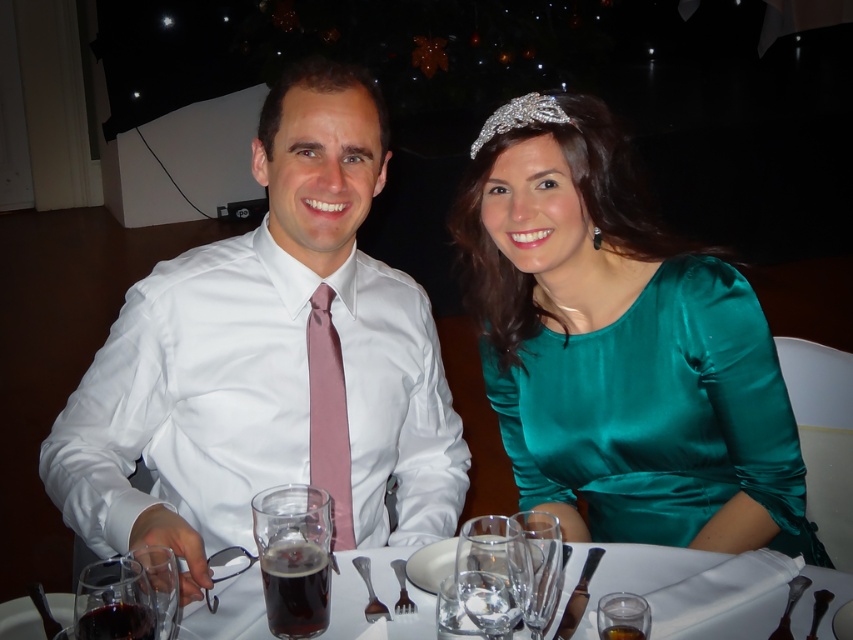
You are a guest at this formal dinner and need to use the utensils. Which one is positioned higher on the table between the polished metal spoon at lower right and the shiny metal fork at lower center?

The polished metal spoon at lower right is positioned higher than the shiny metal fork at lower center according to the description.

Looking at this image, you are a photographer setting up for a group photo at this dining table. The polished metal spoon at lower right is reflecting the scene. To avoid the spoon reflecting the photographer, where should you position yourself relative to the spoon?

To avoid the spoon reflecting the photographer, position yourself outside the reflection angle of the polished metal spoon at lower right. Since the spoon is at point (x=790, y=605), moving to a position not directly in line with the reflection would prevent your image from appearing in the spoon.

You are a guest at this formal dinner and need to grab your drink. Where exactly is the transparent glass at lower center located in relation to the table?

The transparent glass at lower center is located at point [492,573] on the table.